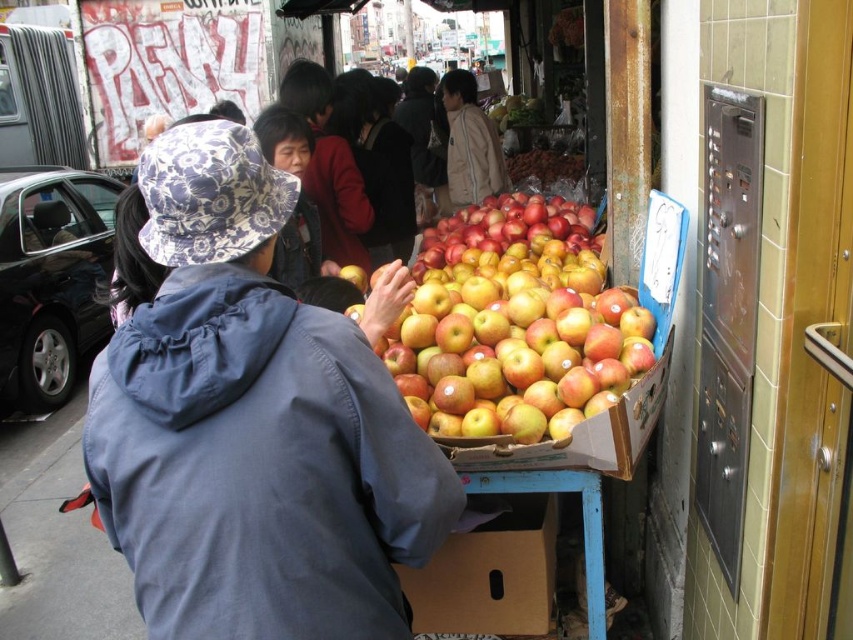
You are a customer at the market and want to reach the brown cardboard box at lower center to buy apples. There is a matte black jacket at center blocking your path. Based on the scene description, which direction should you move to go around the obstacle?

The brown cardboard box at lower center is to the right of the matte black jacket at center. To go around the obstacle, you should move to the right side of the matte black jacket at center to reach the brown cardboard box at lower center.

You are a customer at the market and want to know if the glossy red apples at center are taller than the light brown jacket at center. Can you determine this based on the scene?

The glossy red apples at center is not as tall as light brown jacket at center.